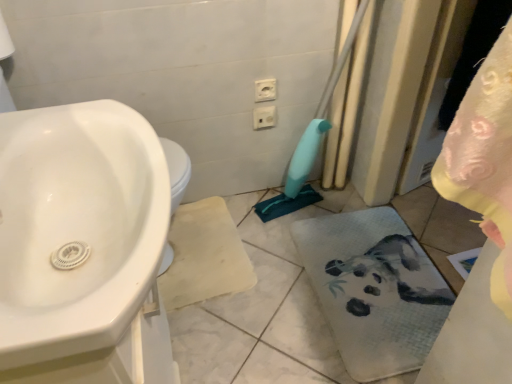
Locate an element on the screen. vacant region below white fabric bath towel at lower right (from a real-world perspective) is located at coordinates (375, 288).